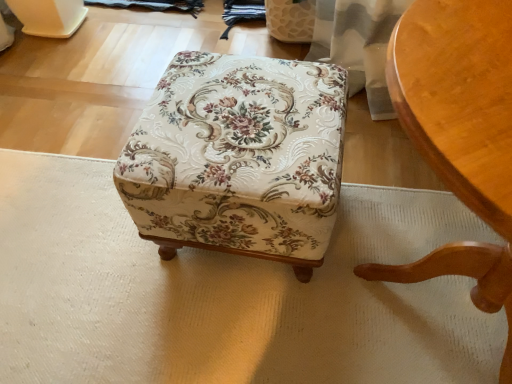
Question: Do you think light brown wood chair at lower right is within floral fabric ottoman at center, or outside of it?

Choices:
 (A) inside
 (B) outside

Answer: (B)

Question: From the image's perspective, relative to floral fabric ottoman at center, is light brown wood chair at lower right above or below?

Choices:
 (A) above
 (B) below

Answer: (B)

Question: Does point (466, 140) appear closer or farther from the camera than point (313, 258)?

Choices:
 (A) closer
 (B) farther

Answer: (A)

Question: Is floral fabric ottoman at center situated inside light brown wood chair at lower right or outside?

Choices:
 (A) inside
 (B) outside

Answer: (B)

Question: From a real-world perspective, relative to light brown wood chair at lower right, is floral fabric ottoman at center vertically above or below?

Choices:
 (A) below
 (B) above

Answer: (A)

Question: Considering the positions of floral fabric ottoman at center and light brown wood chair at lower right in the image, is floral fabric ottoman at center taller or shorter than light brown wood chair at lower right?

Choices:
 (A) tall
 (B) short

Answer: (B)

Question: In terms of width, does floral fabric ottoman at center look wider or thinner when compared to light brown wood chair at lower right?

Choices:
 (A) thin
 (B) wide

Answer: (A)